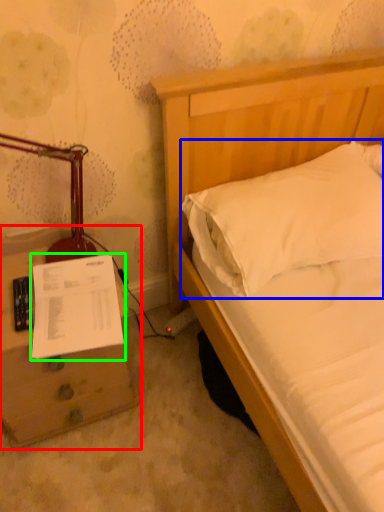
Question: Which is farther away from nightstand (highlighted by a red box)? pillow (highlighted by a blue box) or document (highlighted by a green box)?

Choices:
 (A) pillow
 (B) document

Answer: (A)